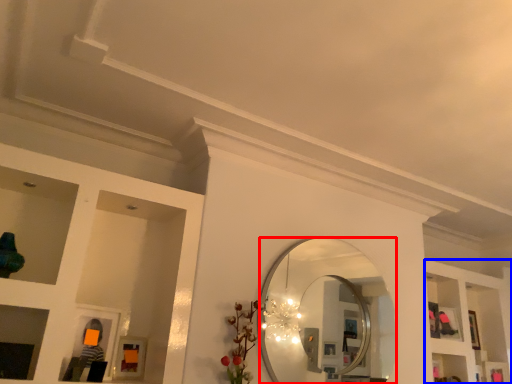
Question: Which object appears closest to the camera in this image, mirror (highlighted by a red box) or shelf (highlighted by a blue box)?

Choices:
 (A) mirror
 (B) shelf

Answer: (A)